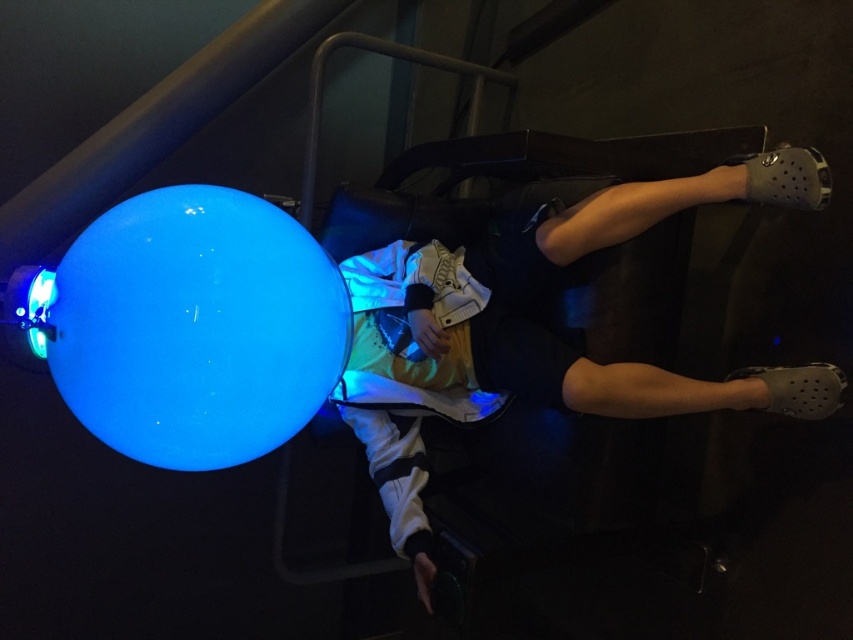
Question: Is white fabric pants at center bigger than glossy blue sphere at center?

Choices:
 (A) no
 (B) yes

Answer: (B)

Question: Is white fabric pants at center to the right of glossy blue sphere at center from the viewer's perspective?

Choices:
 (A) yes
 (B) no

Answer: (A)

Question: Can you confirm if white fabric pants at center is wider than glossy blue sphere at center?

Choices:
 (A) no
 (B) yes

Answer: (B)

Question: Which point is farther from the camera taking this photo?

Choices:
 (A) (138, 252)
 (B) (534, 285)

Answer: (B)